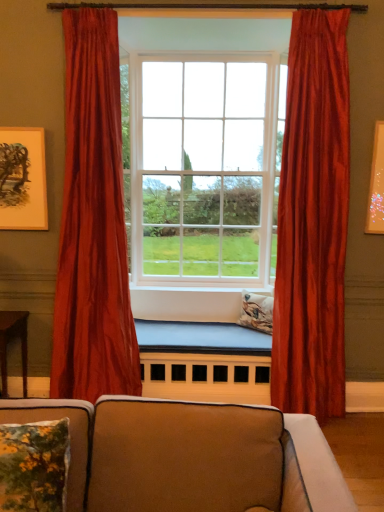
Question: Is wooden table at lower left shorter than satin red curtain at left, the second curtain when ordered from right to left?

Choices:
 (A) yes
 (B) no

Answer: (A)

Question: From a real-world perspective, is wooden table at lower left located beneath satin red curtain at left, the second curtain when ordered from right to left?

Choices:
 (A) no
 (B) yes

Answer: (B)

Question: Could you tell me if wooden table at lower left is facing satin red curtain at left, the second curtain when ordered from right to left?

Choices:
 (A) no
 (B) yes

Answer: (A)

Question: Is the depth of wooden table at lower left greater than that of satin red curtain at left, the second curtain when ordered from right to left?

Choices:
 (A) yes
 (B) no

Answer: (A)

Question: From the image's perspective, does wooden table at lower left appear lower than satin red curtain at left, positioned as the first curtain in left-to-right order?

Choices:
 (A) yes
 (B) no

Answer: (A)

Question: From a real-world perspective, is matte glass window at center physically located above or below floral fabric pillow at lower left, which is counted as the 2th pillow, starting from the right?

Choices:
 (A) above
 (B) below

Answer: (A)

Question: Which is correct: matte glass window at center is inside floral fabric pillow at lower left, which is counted as the 2th pillow, starting from the right, or outside of it?

Choices:
 (A) inside
 (B) outside

Answer: (B)

Question: Considering the positions of matte glass window at center and floral fabric pillow at lower left, arranged as the 1th pillow when viewed from the left, in the image, is matte glass window at center bigger or smaller than floral fabric pillow at lower left, arranged as the 1th pillow when viewed from the left,?

Choices:
 (A) small
 (B) big

Answer: (B)

Question: Considering the positions of matte glass window at center and floral fabric pillow at lower left, which is the second pillow in back-to-front order, in the image, is matte glass window at center wider or thinner than floral fabric pillow at lower left, which is the second pillow in back-to-front order,?

Choices:
 (A) thin
 (B) wide

Answer: (B)

Question: Considering the positions of floral fabric pillow at center, acting as the first pillow starting from the top, and satin red curtain at right, which ranks as the 1th curtain in right-to-left order, in the image, is floral fabric pillow at center, acting as the first pillow starting from the top, wider or thinner than satin red curtain at right, which ranks as the 1th curtain in right-to-left order,?

Choices:
 (A) thin
 (B) wide

Answer: (A)

Question: From their relative heights in the image, would you say floral fabric pillow at center, positioned as the first pillow in right-to-left order, is taller or shorter than satin red curtain at right, which ranks as the 1th curtain in right-to-left order?

Choices:
 (A) short
 (B) tall

Answer: (A)

Question: Would you say floral fabric pillow at center, which is the second pillow from front to back, is inside or outside satin red curtain at right, which ranks as the 1th curtain in right-to-left order?

Choices:
 (A) inside
 (B) outside

Answer: (B)

Question: From the image's perspective, is floral fabric pillow at center, positioned as the first pillow in back-to-front order, located above or below satin red curtain at right, which ranks as the 1th curtain in right-to-left order?

Choices:
 (A) above
 (B) below

Answer: (B)

Question: Considering the positions of wooden table at lower left and floral fabric pillow at lower left, which is counted as the 2th pillow, starting from the right, in the image, is wooden table at lower left wider or thinner than floral fabric pillow at lower left, which is counted as the 2th pillow, starting from the right,?

Choices:
 (A) wide
 (B) thin

Answer: (A)

Question: In terms of height, does wooden table at lower left look taller or shorter compared to floral fabric pillow at lower left, arranged as the 1th pillow when viewed from the left?

Choices:
 (A) tall
 (B) short

Answer: (A)